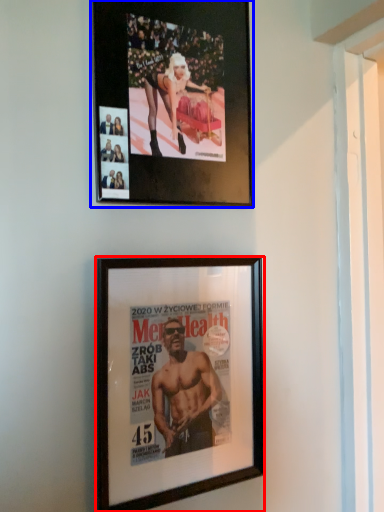
Question: Which point is further to the camera, picture frame (highlighted by a red box) or picture frame (highlighted by a blue box)?

Choices:
 (A) picture frame
 (B) picture frame

Answer: (B)